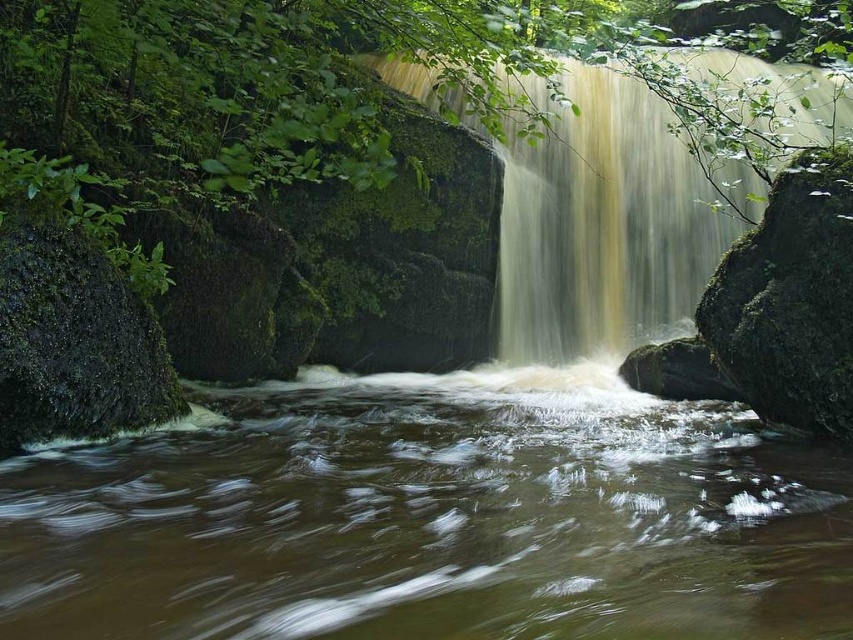
Question: Is yellowish-green mossy rock at center bigger than green mossy rock at left?

Choices:
 (A) no
 (B) yes

Answer: (B)

Question: Which object is farther from the camera taking this photo?

Choices:
 (A) green mossy rock at right
 (B) green mossy rock at left
 (C) yellowish-green mossy rock at center
 (D) brown/muddy water at center

Answer: (C)

Question: Does brown/muddy water at center appear on the right side of green mossy rock at right?

Choices:
 (A) no
 (B) yes

Answer: (A)

Question: Based on their relative distances, which object is farther from the green mossy rock at left?

Choices:
 (A) green mossy rock at right
 (B) yellowish-green mossy rock at center
 (C) brown/muddy water at center

Answer: (B)

Question: Which point is closer to the camera?

Choices:
 (A) (366, 605)
 (B) (122, 355)
 (C) (672, 225)
 (D) (743, 349)

Answer: (A)

Question: Is brown/muddy water at center positioned at the back of green mossy rock at right?

Choices:
 (A) yes
 (B) no

Answer: (B)